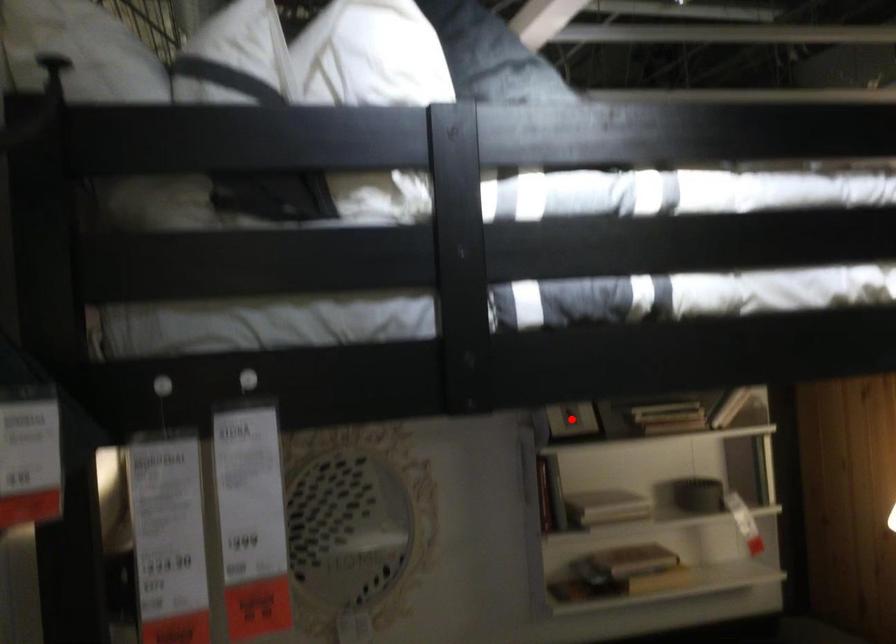
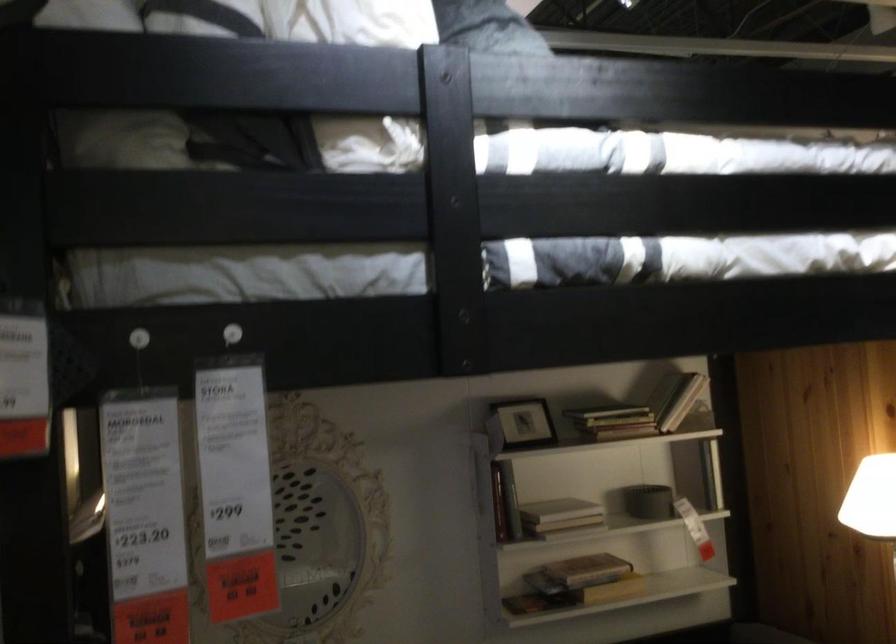
Locate, in the second image, the point that corresponds to the highlighted location in the first image.

(522, 422)